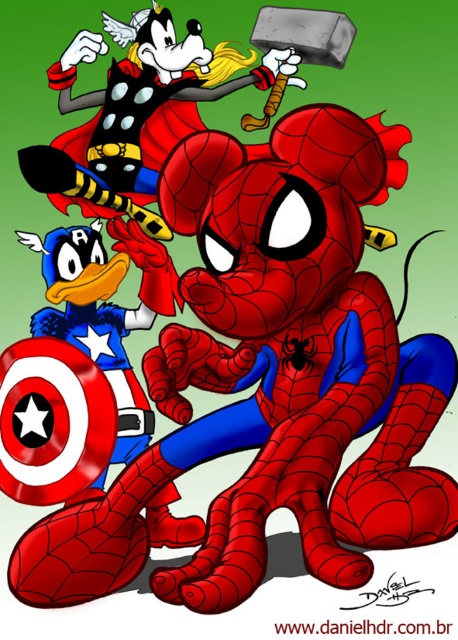
Looking at the image, where is the shiny metallic hammer at upper center in relation to the shiny metallic shield at lower left?

The shiny metallic hammer at upper center is to the right of the shiny metallic shield at lower left.

You are a photographer trying to capture a clear shot of both the shiny metallic hammer at upper center and the shiny metallic shield at lower left in the image. Which object should you focus on first if you want to ensure both are in focus?

The shiny metallic hammer at upper center is positioned over the shiny metallic shield at lower left, so focusing on the hammer first would allow both objects to be in focus as the shield is behind it.

You are a photographer trying to capture the shiny metallic hammer at upper center in your shot. The camera is positioned to focus on the Spider Man character. Will the hammer be visible in the photo if the camera is centered on Spider Man?

The shiny metallic hammer at upper center is located at point (134,108), which is near the left side of the Spider Man character. Since the camera is centered on Spider Man, the hammer should still be visible in the photo as it is positioned to the left of Spider Man.